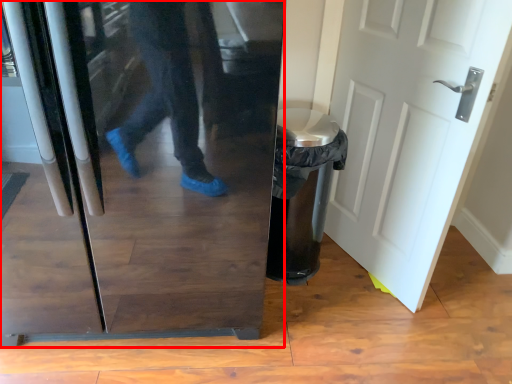
Question: From the image's perspective, what is the correct spatial relationship of refrigerator (annotated by the red box) in relation to door?

Choices:
 (A) below
 (B) above

Answer: (A)